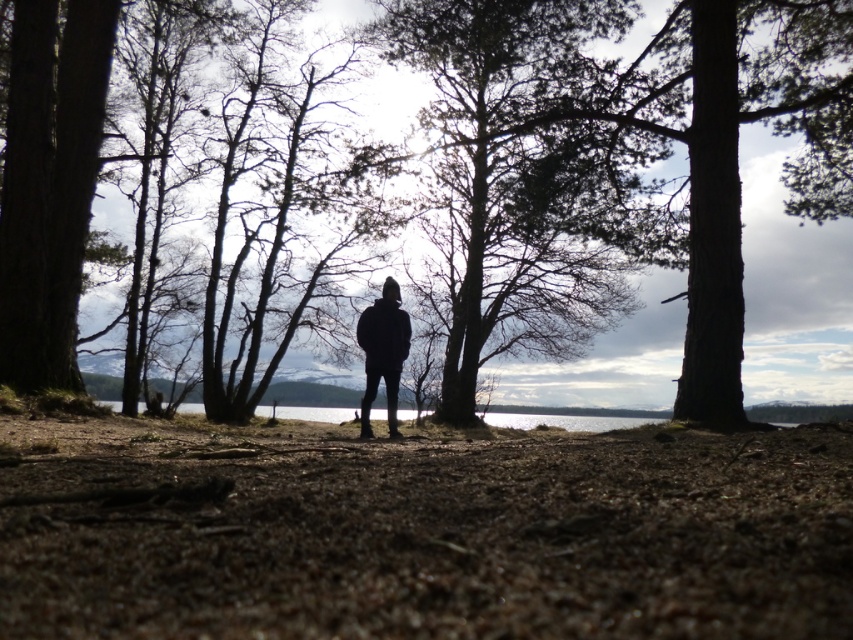
Question: In this image, where is dark green textured tree at center located relative to black matte jacket at center?

Choices:
 (A) above
 (B) below

Answer: (A)

Question: Is dark green textured tree at center wider than black matte jacket at center?

Choices:
 (A) no
 (B) yes

Answer: (B)

Question: Observing the image, what is the correct spatial positioning of brown textured tree at center in reference to dark green textured tree at center?

Choices:
 (A) left
 (B) right

Answer: (A)

Question: Which of the following is the closest to the observer?

Choices:
 (A) (392, 308)
 (B) (599, 208)
 (C) (28, 321)

Answer: (A)

Question: Which point is farther to the camera?

Choices:
 (A) (524, 346)
 (B) (387, 412)
 (C) (78, 244)

Answer: (A)

Question: Which point is farther to the camera?

Choices:
 (A) black matte jacket at center
 (B) dark green textured tree at center
 (C) brown textured tree at center

Answer: (B)